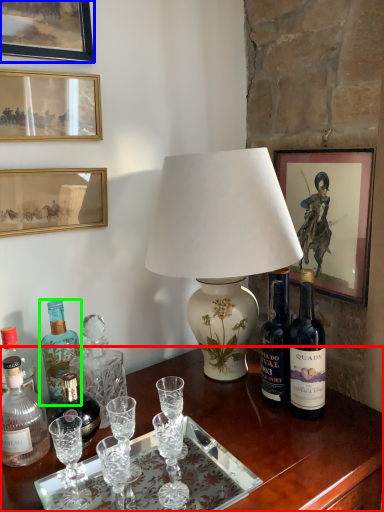
Question: Which object is the closest to the desk (highlighted by a red box)? Choose among these: picture frame (highlighted by a blue box) or bottle (highlighted by a green box).

Choices:
 (A) picture frame
 (B) bottle

Answer: (B)